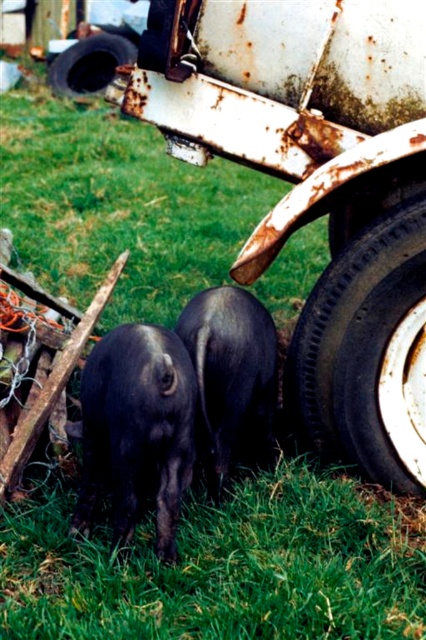
Based on the photo, does green grass at lower center have a greater height compared to black rubber tire at lower left?

Incorrect, green grass at lower center's height is not larger of black rubber tire at lower left's.

Is green grass at lower center further to the viewer compared to black rubber tire at lower left?

No, it is in front of black rubber tire at lower left.

Between point (261, 548) and point (132, 54), which one is positioned behind?

Point (132, 54)

Locate an element on the screen. The image size is (426, 640). green grass at lower center is located at coordinates (224, 566).

Who is more distant from viewer, (222, 392) or (77, 84)?

Positioned behind is point (77, 84).

Does black matte pig at center have a greater height compared to black rubber tire at lower left?

No.

Is point (222, 428) closer to viewer compared to point (78, 44)?

Yes, point (222, 428) is closer to viewer.

What are the coordinates of `black matte pig at center` in the screenshot? It's located at (233, 380).

Which is above, black rubber tire at lower right or shiny black pig at center?

black rubber tire at lower right

In the scene shown: Who is more forward, (379,401) or (92,381)?

Point (92,381) is in front.

Identify the location of black rubber tire at lower right. This screenshot has width=426, height=640. (365, 355).